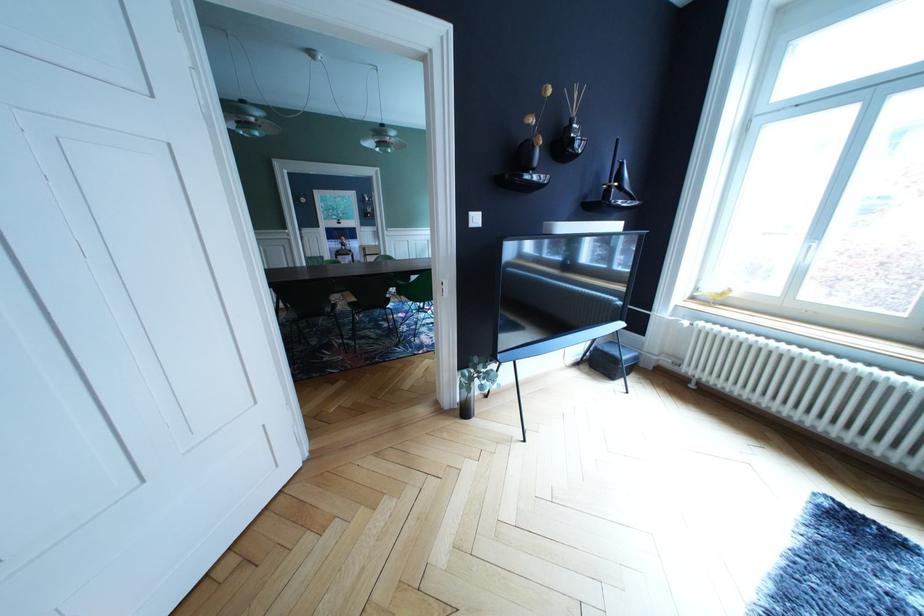
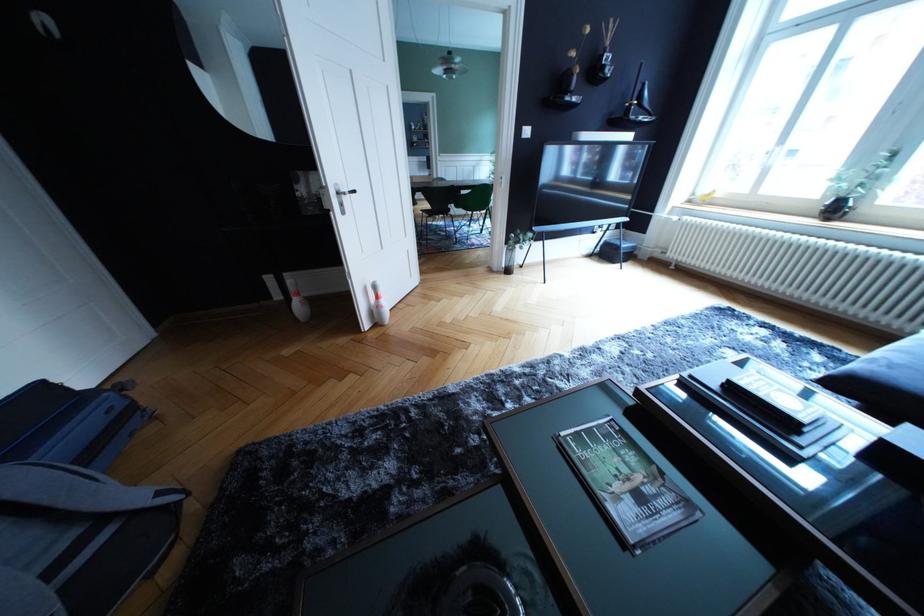
Find the pixel in the second image that matches pixel 594 262 in the first image.

(622, 180)